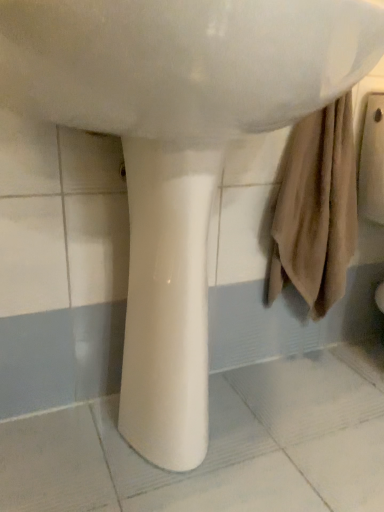
Question: From their relative heights in the image, would you say white glossy pedestal at center is taller or shorter than white glossy sink at center?

Choices:
 (A) short
 (B) tall

Answer: (B)

Question: Is white glossy pedestal at center inside the boundaries of white glossy sink at center, or outside?

Choices:
 (A) outside
 (B) inside

Answer: (A)

Question: Is point (190, 158) positioned closer to the camera than point (258, 0)?

Choices:
 (A) closer
 (B) farther

Answer: (B)

Question: In terms of height, does white glossy sink at center look taller or shorter compared to white glossy pedestal at center?

Choices:
 (A) short
 (B) tall

Answer: (A)

Question: From the image's perspective, relative to white glossy pedestal at center, is white glossy sink at center above or below?

Choices:
 (A) below
 (B) above

Answer: (B)

Question: Is white glossy sink at center in front of or behind white glossy pedestal at center in the image?

Choices:
 (A) behind
 (B) front

Answer: (B)

Question: From a real-world perspective, is white glossy sink at center above or below white glossy pedestal at center?

Choices:
 (A) below
 (B) above

Answer: (B)